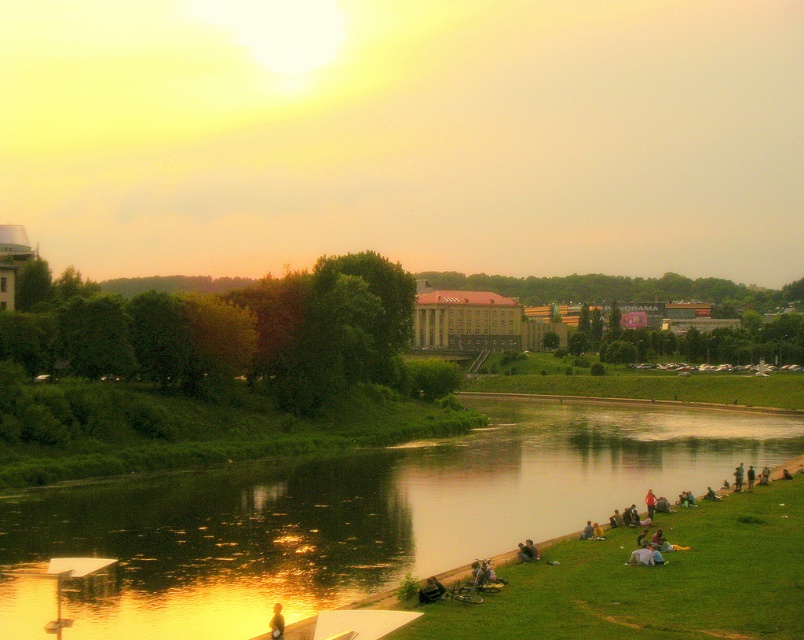
Is green grass at lower right to the right of smooth white shirt at lower right from the viewer's perspective?

Indeed, green grass at lower right is positioned on the right side of smooth white shirt at lower right.

Is green grass at lower right behind smooth white shirt at lower right?

No, green grass at lower right is closer to the viewer.

Is point (716, 504) farther from camera compared to point (634, 563)?

Yes, point (716, 504) is behind point (634, 563).

You are a GUI agent. You are given a task and a screenshot of the screen. Output one action in this format:
    pyautogui.click(x=<x>, y=<y>)
    Task: Click on the green grass at lower right
    The image size is (804, 640).
    Given the screenshot: What is the action you would take?
    pyautogui.click(x=651, y=580)

Describe the element at coordinates (370, 512) in the screenshot. The width and height of the screenshot is (804, 640). I see `green reflective water at center` at that location.

Is point (160, 497) positioned before point (638, 548)?

No, it is not.

Identify the location of green reflective water at center. (370, 512).

Is point (444, 461) positioned behind point (277, 609)?

Yes.

Does green reflective water at center have a larger size compared to smooth skin person at lower center?

Yes.

Between point (575, 424) and point (282, 620), which one is positioned behind?

Positioned behind is point (575, 424).

Locate an element on the screen. The height and width of the screenshot is (640, 804). green reflective water at center is located at coordinates (370, 512).